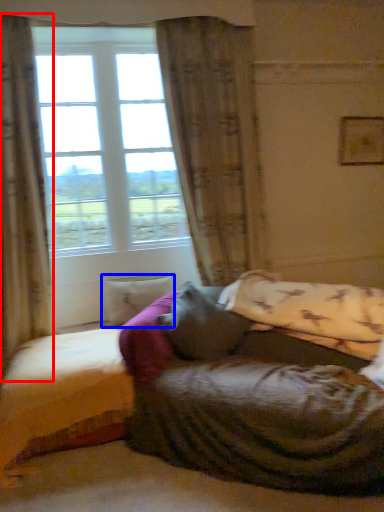
Question: Which of the following is the closest to the observer, curtain (highlighted by a red box) or pillow (highlighted by a blue box)?

Choices:
 (A) curtain
 (B) pillow

Answer: (A)